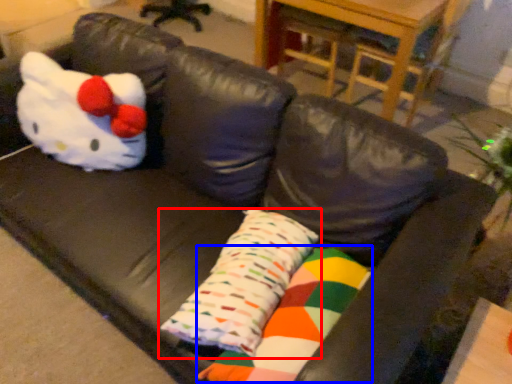
Question: Which object appears farthest to the camera in this image, pillow (highlighted by a red box) or material (highlighted by a blue box)?

Choices:
 (A) pillow
 (B) material

Answer: (A)